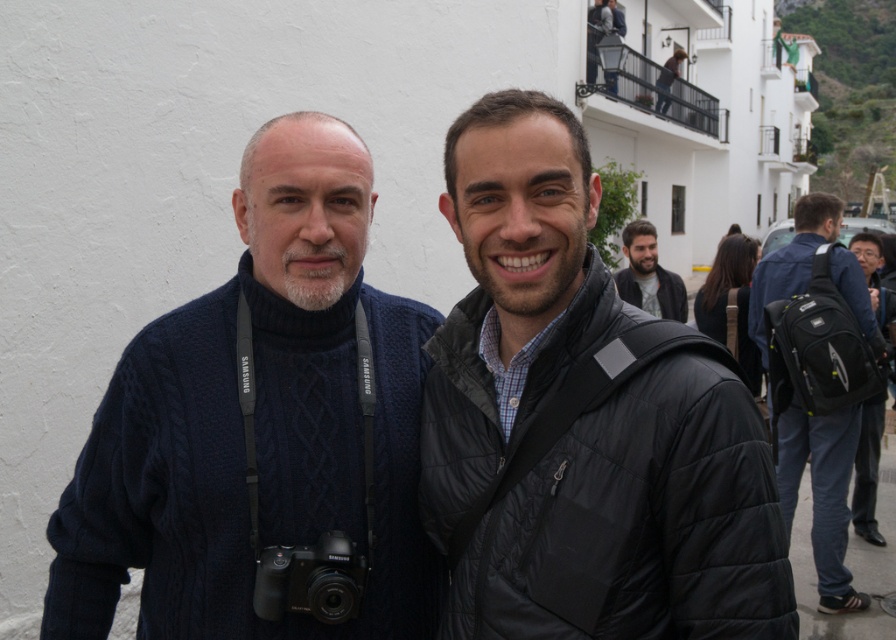
Question: Which object is farther from the camera taking this photo?

Choices:
 (A) black synthetic backpack at right
 (B) black matte backpack at right
 (C) bearded man at center
 (D) cable-knit sweater at center

Answer: (C)

Question: Is black plastic camera at center to the right of black matte backpack at right from the viewer's perspective?

Choices:
 (A) no
 (B) yes

Answer: (A)

Question: Is black matte backpack at right to the right of bearded man at center from the viewer's perspective?

Choices:
 (A) no
 (B) yes

Answer: (B)

Question: Which object is closer to the camera taking this photo?

Choices:
 (A) black quilted jacket at center
 (B) cable-knit sweater at center
 (C) black matte backpack at right

Answer: (A)

Question: Is cable-knit sweater at center in front of black matte backpack at right?

Choices:
 (A) yes
 (B) no

Answer: (A)

Question: Which of the following is the closest to the observer?

Choices:
 (A) black synthetic backpack at right
 (B) black matte backpack at right
 (C) cable-knit sweater at center

Answer: (C)